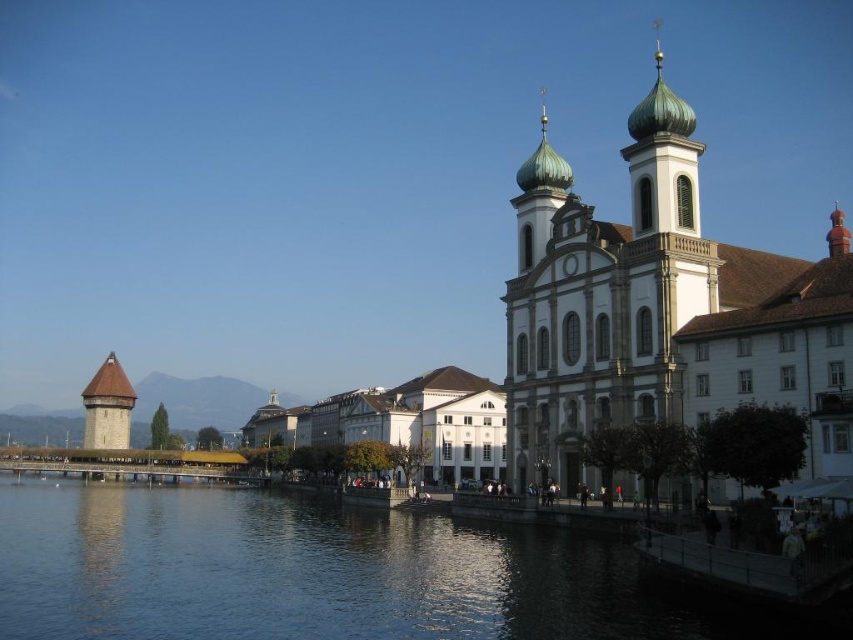
Question: Among these objects, which one is farthest from the camera?

Choices:
 (A) blue water at lower center
 (B) brown wood tower at left

Answer: (B)

Question: Can you confirm if green copper dome church at right is smaller than brown wood tower at left?

Choices:
 (A) no
 (B) yes

Answer: (A)

Question: Where is blue water at lower center located in relation to brown wood tower at left in the image?

Choices:
 (A) right
 (B) left

Answer: (A)

Question: Which object is closer to the camera taking this photo?

Choices:
 (A) blue water at lower center
 (B) green copper dome church at right
 (C) brown wood tower at left

Answer: (A)

Question: Considering the relative positions of blue water at lower center and green copper dome church at right in the image provided, where is blue water at lower center located with respect to green copper dome church at right?

Choices:
 (A) left
 (B) right

Answer: (A)

Question: Which point is closer to the camera?

Choices:
 (A) blue water at lower center
 (B) brown wood tower at left
 (C) green copper dome church at right

Answer: (A)